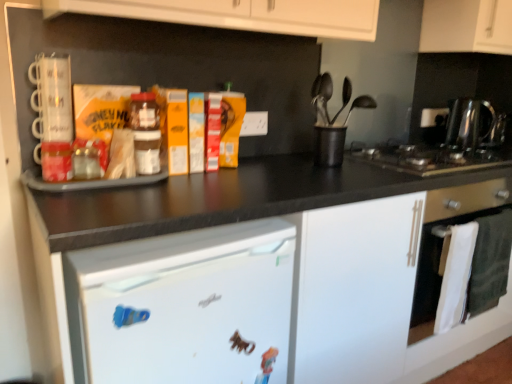
Question: From a real-world perspective, is white matte cabinet at upper right located higher than polished stainless steel kettle at right?

Choices:
 (A) no
 (B) yes

Answer: (B)

Question: From the image's perspective, is white matte cabinet at upper right above polished stainless steel kettle at right?

Choices:
 (A) yes
 (B) no

Answer: (A)

Question: From the image's perspective, is white matte cabinet at upper right beneath polished stainless steel kettle at right?

Choices:
 (A) yes
 (B) no

Answer: (B)

Question: Is white matte cabinet at upper right positioned beyond the bounds of polished stainless steel kettle at right?

Choices:
 (A) yes
 (B) no

Answer: (A)

Question: From a real-world perspective, is white matte cabinet at upper right physically below polished stainless steel kettle at right?

Choices:
 (A) no
 (B) yes

Answer: (A)

Question: Is white matte cabinet at upper right closer to camera compared to polished stainless steel kettle at right?

Choices:
 (A) no
 (B) yes

Answer: (B)

Question: Is polished stainless steel kettle at right facing away from black plastic utensil holder at center?

Choices:
 (A) yes
 (B) no

Answer: (B)

Question: From a real-world perspective, is polished stainless steel kettle at right physically below black plastic utensil holder at center?

Choices:
 (A) yes
 (B) no

Answer: (B)

Question: Are polished stainless steel kettle at right and black plastic utensil holder at center located far from each other?

Choices:
 (A) yes
 (B) no

Answer: (B)

Question: Is polished stainless steel kettle at right with black plastic utensil holder at center?

Choices:
 (A) no
 (B) yes

Answer: (A)

Question: Does polished stainless steel kettle at right have a lesser height compared to black plastic utensil holder at center?

Choices:
 (A) yes
 (B) no

Answer: (B)

Question: From the image's perspective, is polished stainless steel kettle at right below black plastic utensil holder at center?

Choices:
 (A) no
 (B) yes

Answer: (A)

Question: Does white matte refrigerator at lower left have a smaller size compared to white glossy oven at lower right?

Choices:
 (A) yes
 (B) no

Answer: (B)